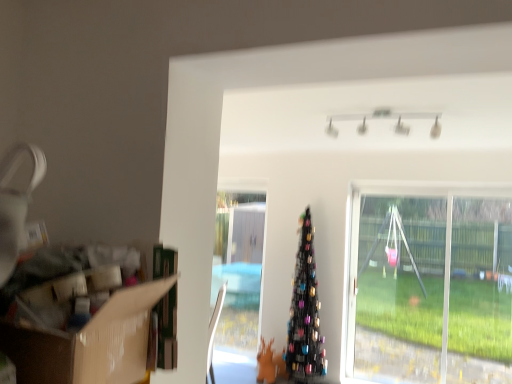
Question: From a real-world perspective, is cardboard box at left located higher than transparent plastic swing at right?

Choices:
 (A) yes
 (B) no

Answer: (A)

Question: Is transparent plastic swing at right at the back of cardboard box at left?

Choices:
 (A) yes
 (B) no

Answer: (B)

Question: From the image's perspective, does cardboard box at left appear higher than transparent plastic swing at right?

Choices:
 (A) no
 (B) yes

Answer: (B)

Question: Can you confirm if cardboard box at left is positioned to the left of transparent plastic swing at right?

Choices:
 (A) yes
 (B) no

Answer: (A)

Question: Are cardboard box at left and transparent plastic swing at right beside each other?

Choices:
 (A) yes
 (B) no

Answer: (B)

Question: From the image's perspective, is cardboard box at left positioned above or below transparent plastic swing at right?

Choices:
 (A) below
 (B) above

Answer: (B)

Question: From a real-world perspective, is cardboard box at left physically located above or below transparent plastic swing at right?

Choices:
 (A) above
 (B) below

Answer: (A)

Question: In the image, is cardboard box at left positioned in front of or behind transparent plastic swing at right?

Choices:
 (A) front
 (B) behind

Answer: (A)

Question: Is cardboard box at left inside the boundaries of transparent plastic swing at right, or outside?

Choices:
 (A) inside
 (B) outside

Answer: (B)

Question: Considering the positions of cardboard box at left and black metallic christmas tree at center in the image, is cardboard box at left wider or thinner than black metallic christmas tree at center?

Choices:
 (A) wide
 (B) thin

Answer: (A)

Question: From their relative heights in the image, would you say cardboard box at left is taller or shorter than black metallic christmas tree at center?

Choices:
 (A) tall
 (B) short

Answer: (B)

Question: From a real-world perspective, is cardboard box at left positioned above or below black metallic christmas tree at center?

Choices:
 (A) below
 (B) above

Answer: (B)

Question: Based on their sizes in the image, would you say cardboard box at left is bigger or smaller than black metallic christmas tree at center?

Choices:
 (A) small
 (B) big

Answer: (A)

Question: Is black metallic christmas tree at center in front of or behind cardboard box at left in the image?

Choices:
 (A) behind
 (B) front

Answer: (A)

Question: From a real-world perspective, is black metallic christmas tree at center positioned above or below cardboard box at left?

Choices:
 (A) below
 (B) above

Answer: (A)